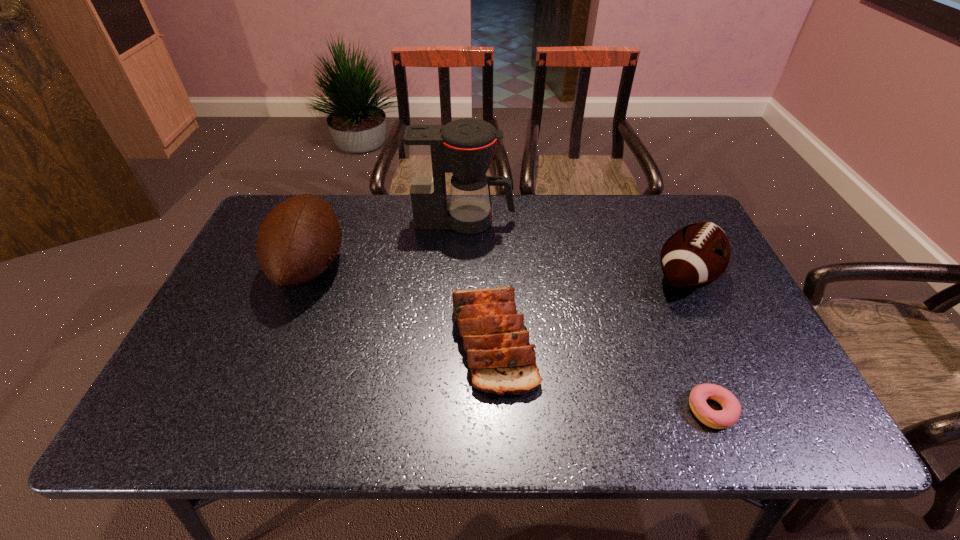
At what (x,y) coordinates should I click in order to perform the action: click on vacant space located on the left of the second shortest object. Please return your answer as a coordinate pair (x, y). Image resolution: width=960 pixels, height=540 pixels. Looking at the image, I should click on (349, 340).

Image resolution: width=960 pixels, height=540 pixels. Find the location of `vacant space situated 0.310m on the back of the shortest object`. vacant space situated 0.310m on the back of the shortest object is located at coordinates (662, 288).

Find the location of `coffee maker located at the far edge`. coffee maker located at the far edge is located at coordinates 465,147.

The image size is (960, 540). What are the coordinates of `football that is at the far edge` in the screenshot? It's located at (300, 237).

Locate an element on the screen. object at the near edge is located at coordinates (731, 411).

Identify the location of object at the left edge. (300, 237).

Locate an element on the screen. The width and height of the screenshot is (960, 540). football (American) at the right edge is located at coordinates (696, 255).

Locate an element on the screen. This screenshot has width=960, height=540. doughnut at the right edge is located at coordinates (731, 411).

Locate an element on the screen. object present at the far left corner is located at coordinates (300, 237).

Identify the location of object located in the near right corner section of the desktop. (731, 411).